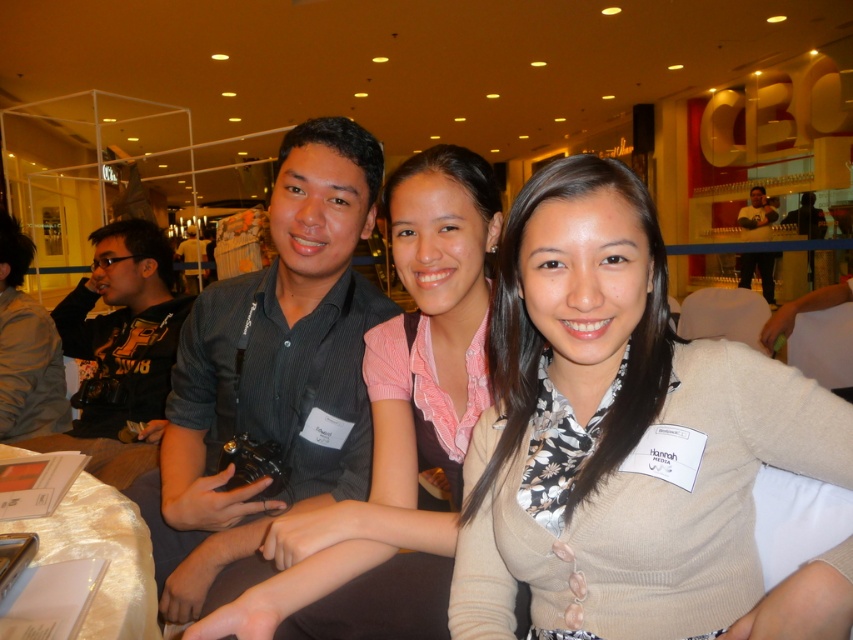
Question: Where is beige cardigan at center located in relation to matte black camera at upper right in the image?

Choices:
 (A) above
 (B) below

Answer: (B)

Question: Which point is farther from the camera taking this photo?

Choices:
 (A) (712, 458)
 (B) (360, 154)
 (C) (149, 241)

Answer: (C)

Question: Which of these objects is positioned closest to the dark gray shirt at left?

Choices:
 (A) black striped shirt at center
 (B) beige cardigan at center

Answer: (A)

Question: In this image, where is beige cardigan at center located relative to black striped shirt at center?

Choices:
 (A) above
 (B) below

Answer: (A)

Question: Is black fabric camera at left smaller than matte black camera at upper right?

Choices:
 (A) yes
 (B) no

Answer: (B)

Question: Among these objects, which one is nearest to the camera?

Choices:
 (A) black fabric camera at left
 (B) dark gray shirt at left

Answer: (A)